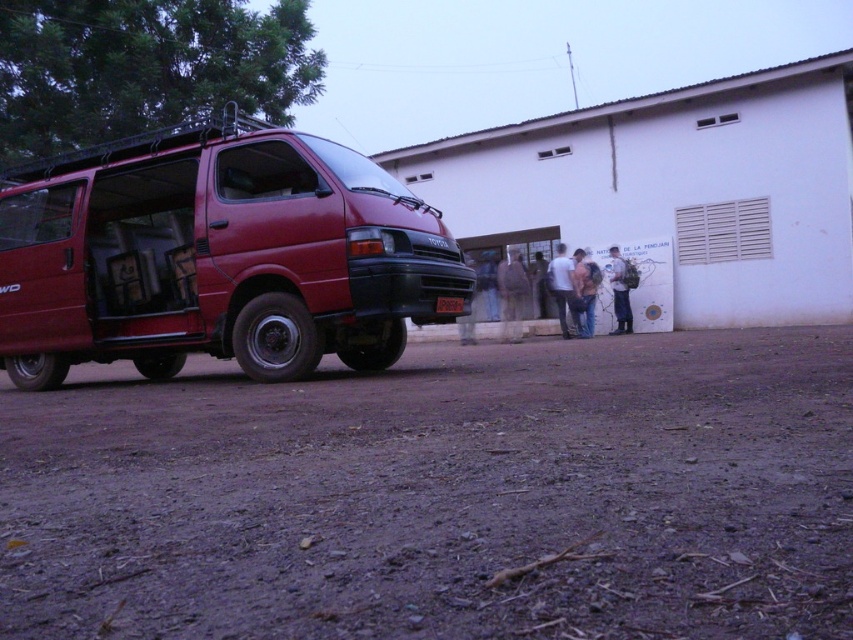
You are a delivery person who needs to park your truck 10 meters away from the matte red van at left. Can you park on the dusty brown dirt at lower center?

The distance between the dusty brown dirt at lower center and the matte red van at left is 8.05 meters. Since you need to park 10 meters away, you cannot park there.

You are standing in front of the red Toyota van and want to take a photo of both the point at coordinates point (689, 412) and point (126, 202). Which point will appear larger in the photo?

Point (689, 412) is closer to the camera than point (126, 202), so it will appear larger in the photo.